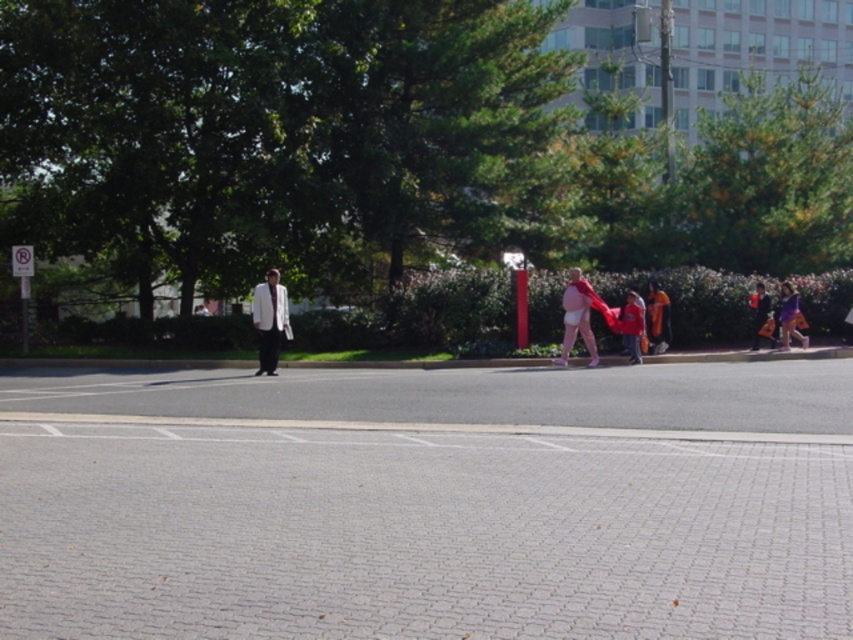
You are a parent carrying a matte pink diaper at center and standing on the gray brick pavement at center. You want to place the diaper on the ground. Will the diaper be above or below the pavement after placing it?

The gray brick pavement at center is below the matte pink diaper at center, so placing the diaper on the pavement will result in the diaper being above the pavement.

You are a delivery person trying to place a matte pink diaper at center on the gray brick pavement at center. Can you place it directly in front of the red pole?

The gray brick pavement at center is closer to the viewer than the matte pink diaper at center, so the diaper is further away from the pole. Therefore, it cannot be placed directly in front of the red pole.